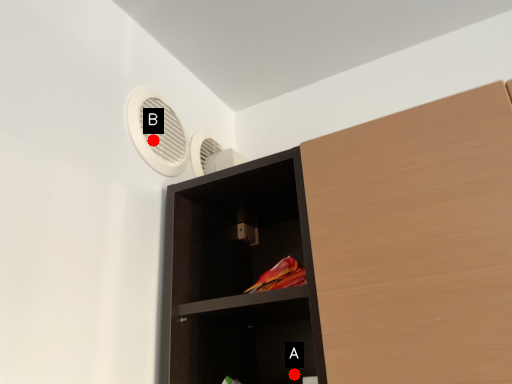
Question: Two points are circled on the image, labeled by A and B beside each circle. Among these points, which one is nearest to the camera?

Choices:
 (A) A is closer
 (B) B is closer

Answer: (B)